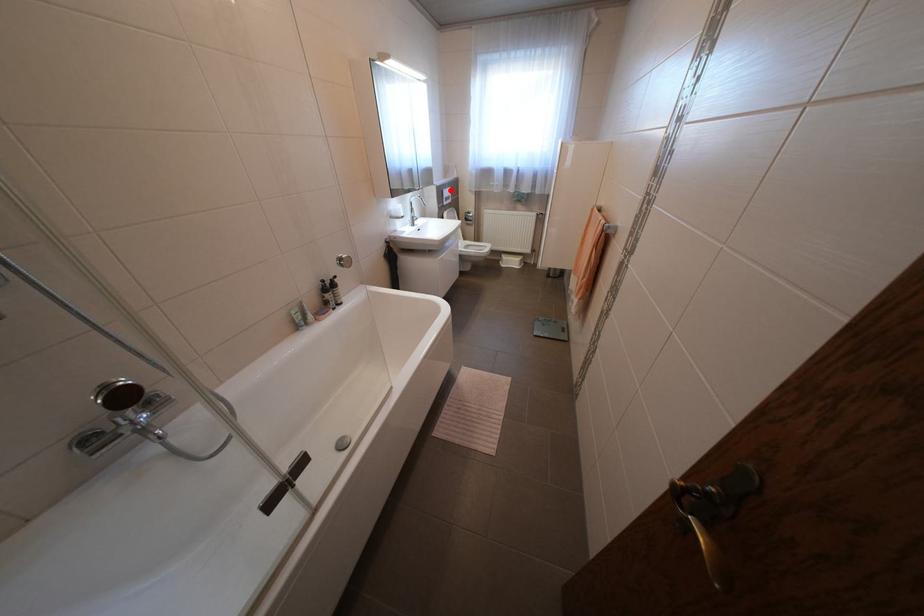
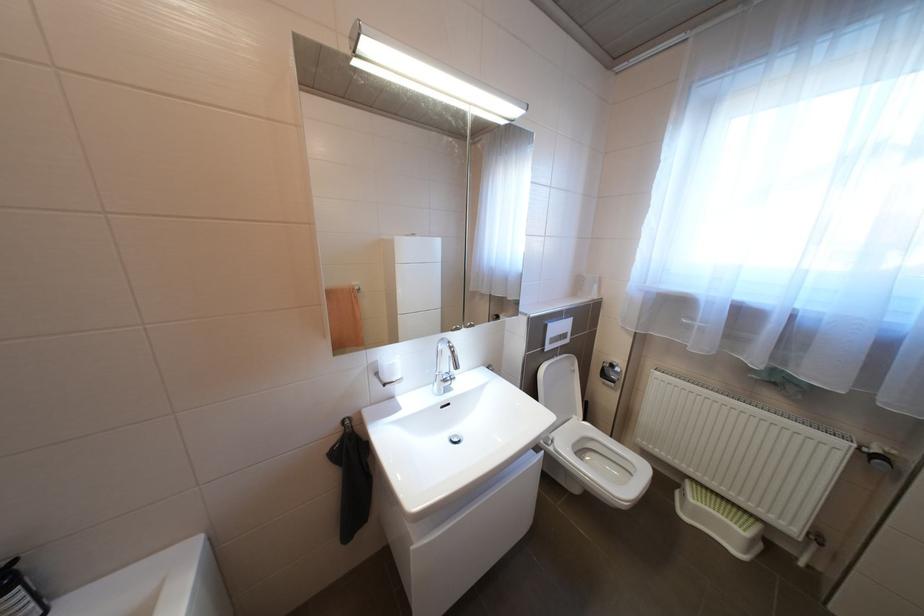
Where in the second image is the point corresponding to the highlighted location from the first image?

(548, 325)